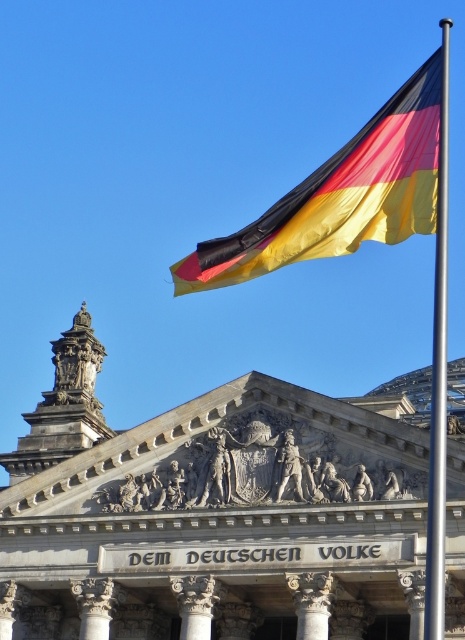
Is polyester flag at upper right bigger than silver metallic pole at upper right?

Correct, polyester flag at upper right is larger in size than silver metallic pole at upper right.

Image resolution: width=465 pixels, height=640 pixels. Describe the element at coordinates (341, 195) in the screenshot. I see `polyester flag at upper right` at that location.

Does point (397, 120) lie in front of point (437, 372)?

Yes.

At what (x,y) coordinates should I click in order to perform the action: click on polyester flag at upper right. Please return your answer as a coordinate pair (x, y). Looking at the image, I should click on (341, 195).